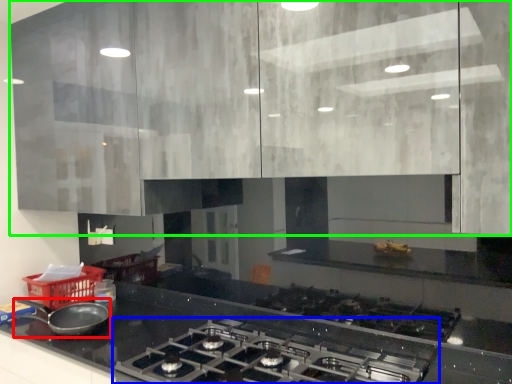
Question: Which object is the closest to the kitchen appliance (highlighted by a red box)? Choose among these: gas stove (highlighted by a blue box) or cabinetry (highlighted by a green box).

Choices:
 (A) gas stove
 (B) cabinetry

Answer: (A)